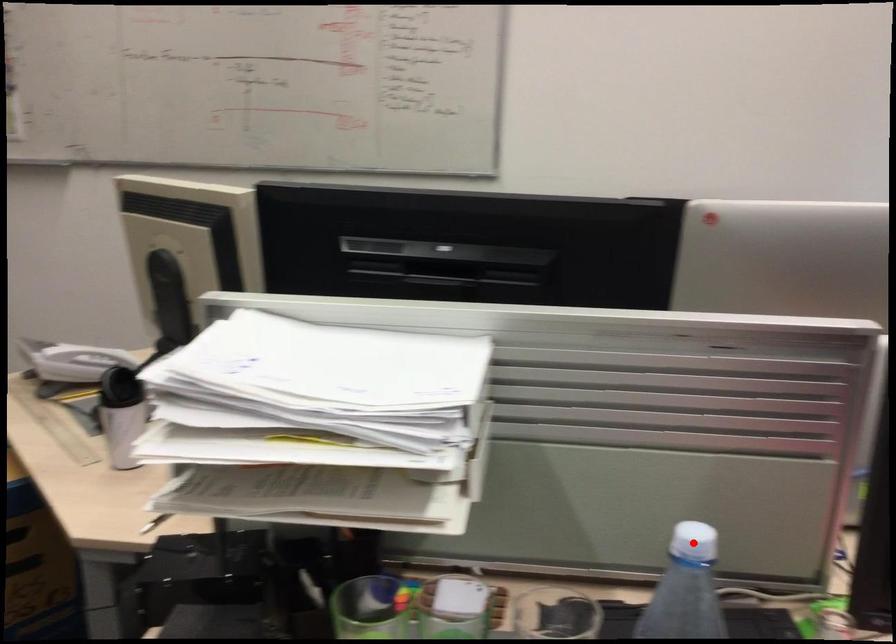
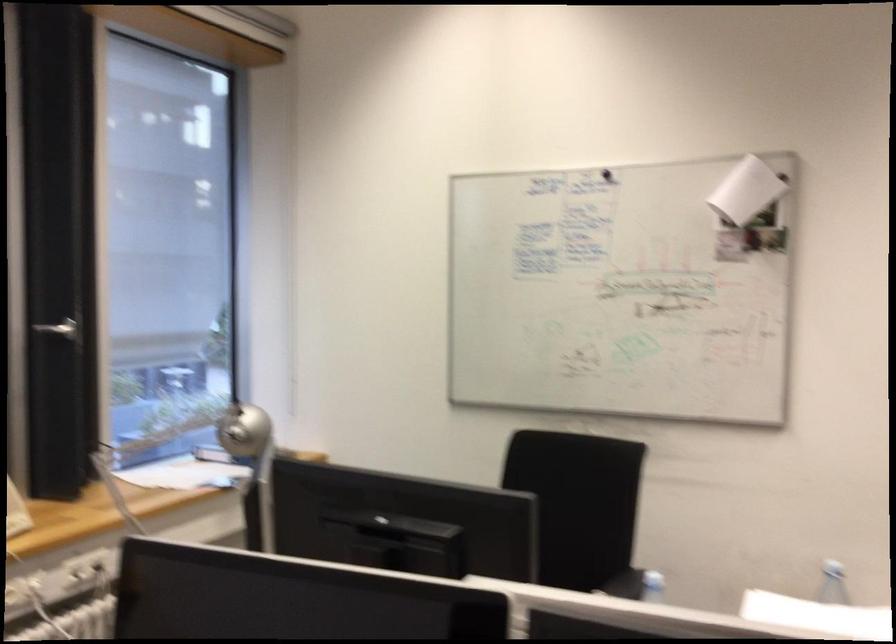
Question: I am providing you with two images of the same scene from different viewpoints. A red point is marked on the first image. At the location where the point appears in image 1, is it still visible in image 2?

Choices:
 (A) Yes
 (B) No

Answer: (B)